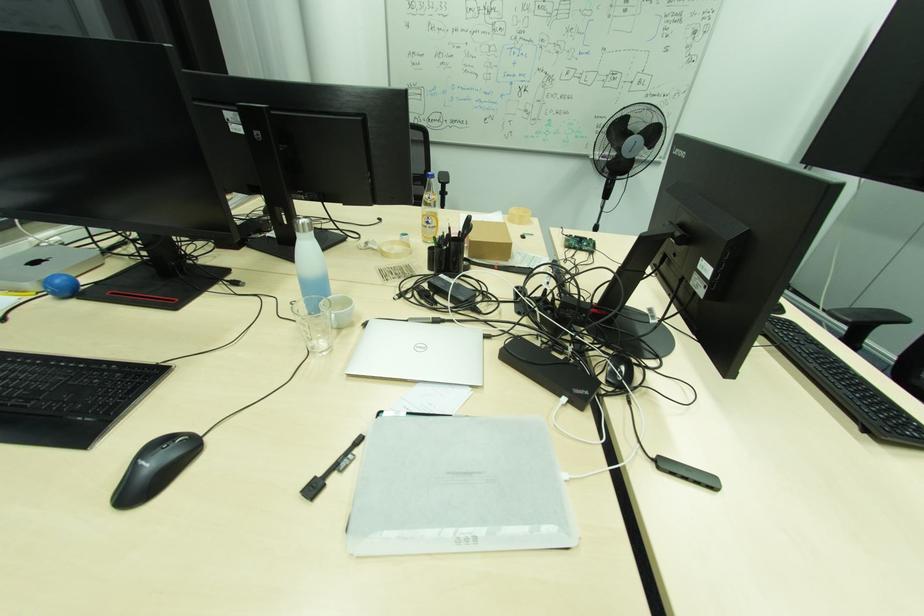
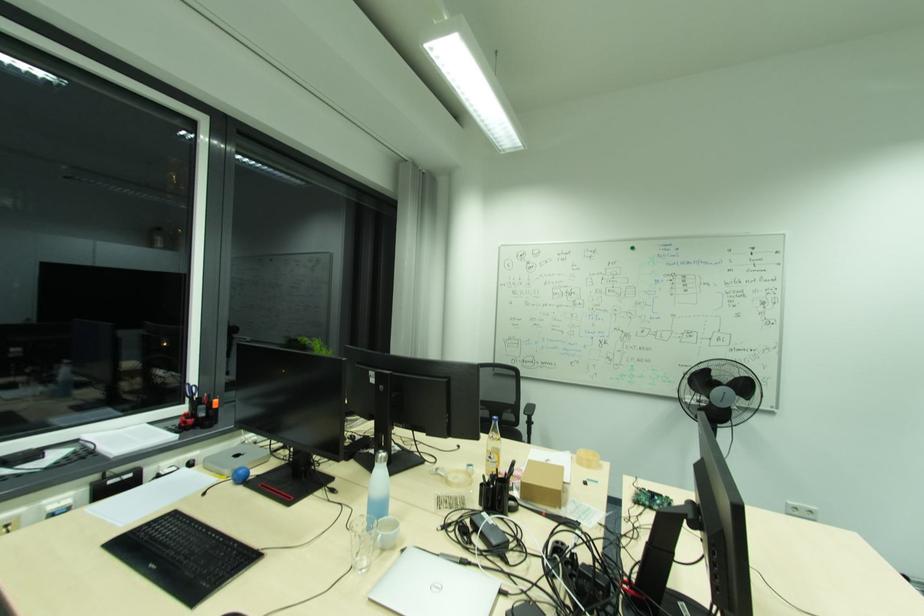
Find the pixel in the second image that matches (63,282) in the first image.

(246, 472)